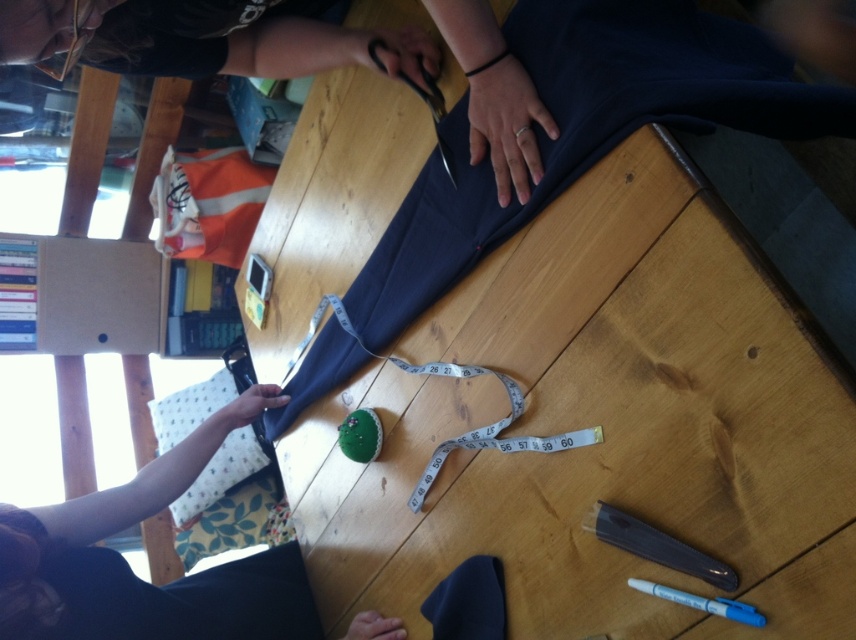
Is point (354, 474) farther from camera compared to point (147, 61)?

Yes, point (354, 474) is farther from viewer.

Can you confirm if wooden table at center is smaller than matte black fabric at upper center?

No.

Based on the photo, who is more forward, (553, 637) or (354, 58)?

Point (553, 637)

You are a GUI agent. You are given a task and a screenshot of the screen. Output one action in this format:
    pyautogui.click(x=<x>, y=<y>)
    Task: Click on the wooden table at center
    This screenshot has width=856, height=640.
    Given the screenshot: What is the action you would take?
    pyautogui.click(x=596, y=422)

Can you confirm if smooth navy fabric at upper left is positioned below blue plastic pen at lower right?

Correct, smooth navy fabric at upper left is located below blue plastic pen at lower right.

Can you confirm if smooth navy fabric at upper left is taller than blue plastic pen at lower right?

Correct, smooth navy fabric at upper left is much taller as blue plastic pen at lower right.

Find the location of a particular element. This screenshot has width=856, height=640. smooth navy fabric at upper left is located at coordinates (134, 576).

Image resolution: width=856 pixels, height=640 pixels. What are the coordinates of `smooth navy fabric at upper left` in the screenshot? It's located at (134, 576).

Which is more to the left, matte black fabric at upper center or metallic sheen scissors at upper center?

Positioned to the left is matte black fabric at upper center.

Does matte black fabric at upper center have a smaller size compared to metallic sheen scissors at upper center?

Incorrect, matte black fabric at upper center is not smaller in size than metallic sheen scissors at upper center.

Which is behind, point (473, 128) or point (444, 164)?

The point (444, 164) is more distant.

Where is `matte black fabric at upper center`? The image size is (856, 640). matte black fabric at upper center is located at coordinates (198, 38).